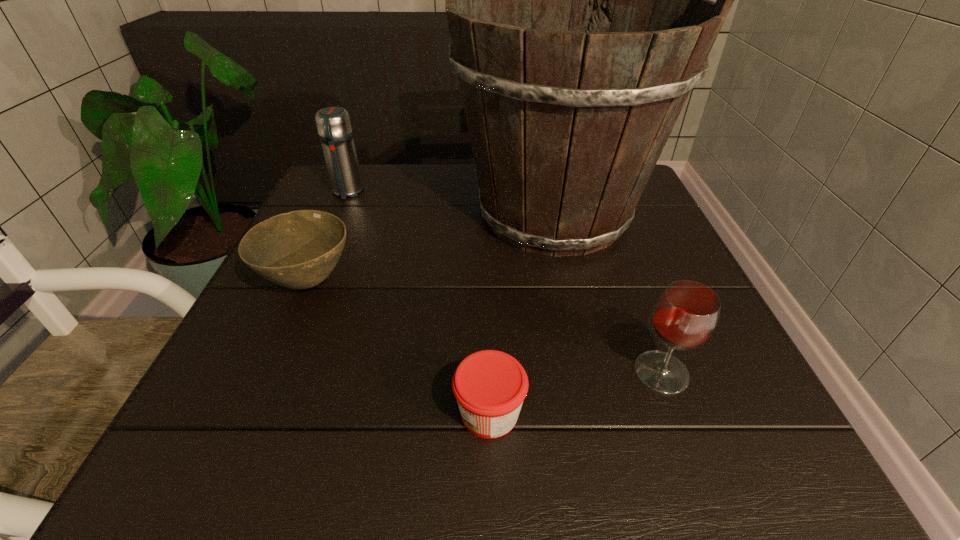
Locate an element on the screen. Image resolution: width=960 pixels, height=540 pixels. free region that satisfies the following two spatial constraints: 1. with a handle on the side of the second shortest object; 2. on the left side of the second tallest object is located at coordinates (307, 282).

The image size is (960, 540). Find the location of `vacant region that satisfies the following two spatial constraints: 1. on the back side of the bucket; 2. on the right side of the second shortest object`. vacant region that satisfies the following two spatial constraints: 1. on the back side of the bucket; 2. on the right side of the second shortest object is located at coordinates (338, 214).